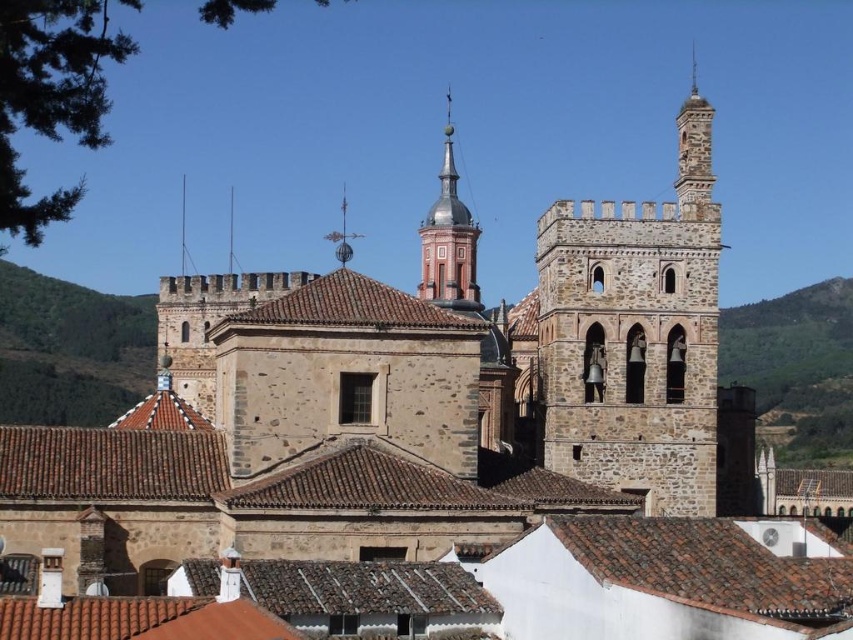
Who is higher up, smooth red brick tower at center or polished silver spire at center?

smooth red brick tower at center

Can you confirm if smooth red brick tower at center is positioned to the right of polished silver spire at center?

Correct, you'll find smooth red brick tower at center to the right of polished silver spire at center.

I want to click on smooth red brick tower at center, so click(450, 241).

Can you confirm if stone textured spire at upper right is smaller than polished silver spire at center?

No, stone textured spire at upper right is not smaller than polished silver spire at center.

The image size is (853, 640). Identify the location of stone textured spire at upper right. (693, 150).

Does stone tower at center appear on the left side of stone textured spire at upper right?

Correct, you'll find stone tower at center to the left of stone textured spire at upper right.

Looking at this image, is stone tower at center to the right of stone textured spire at upper right from the viewer's perspective?

No, stone tower at center is not to the right of stone textured spire at upper right.

Where is `stone tower at center`? The width and height of the screenshot is (853, 640). stone tower at center is located at coordinates (635, 333).

You are a GUI agent. You are given a task and a screenshot of the screen. Output one action in this format:
    pyautogui.click(x=<x>, y=<y>)
    Task: Click on the stone tower at center
    The width and height of the screenshot is (853, 640).
    Given the screenshot: What is the action you would take?
    pyautogui.click(x=635, y=333)